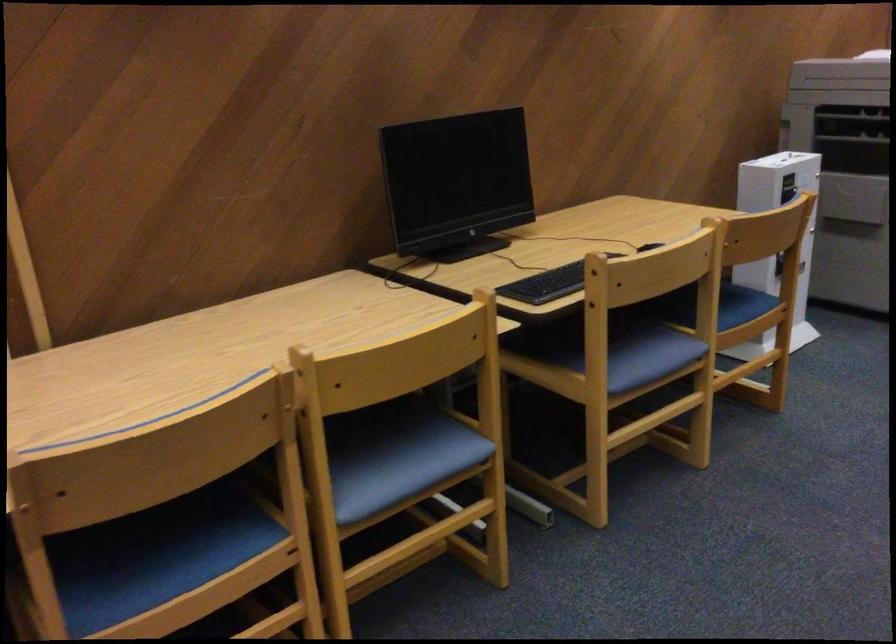
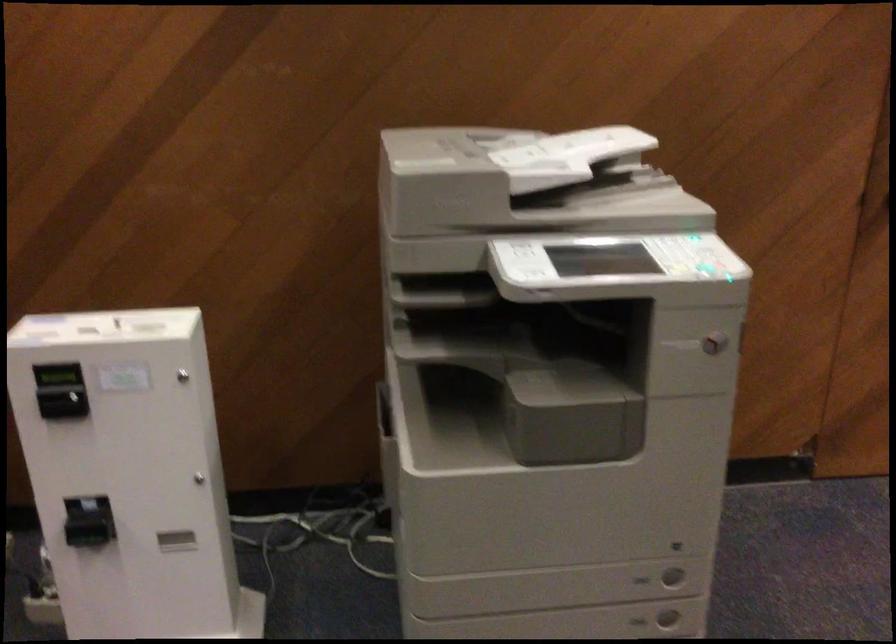
In the second image, find the point that corresponds to pixel 784 172 in the first image.

(56, 375)